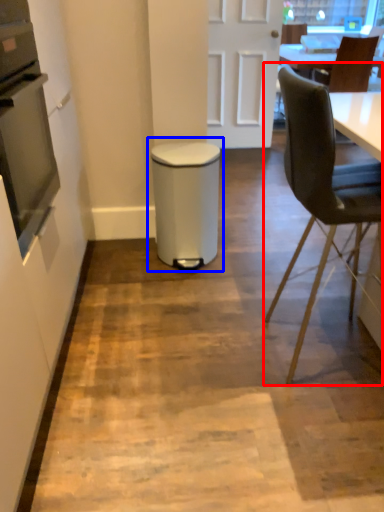
Question: Among these objects, which one is nearest to the camera, chair (highlighted by a red box) or waste container (highlighted by a blue box)?

Choices:
 (A) chair
 (B) waste container

Answer: (A)